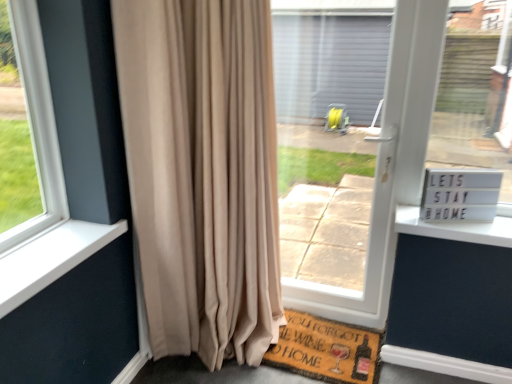
Question: Is brown mat at lower center to the right of brown woven mat at lower center from the viewer's perspective?

Choices:
 (A) yes
 (B) no

Answer: (A)

Question: From a real-world perspective, is brown mat at lower center located beneath brown woven mat at lower center?

Choices:
 (A) yes
 (B) no

Answer: (A)

Question: Considering the relative sizes of brown mat at lower center and brown woven mat at lower center in the image provided, is brown mat at lower center smaller than brown woven mat at lower center?

Choices:
 (A) yes
 (B) no

Answer: (B)

Question: From the image's perspective, does brown mat at lower center appear lower than brown woven mat at lower center?

Choices:
 (A) yes
 (B) no

Answer: (A)

Question: Is brown mat at lower center positioned behind brown woven mat at lower center?

Choices:
 (A) no
 (B) yes

Answer: (A)

Question: In the image, is transparent plastic screen door at center positioned in front of or behind brown woven mat at lower center?

Choices:
 (A) front
 (B) behind

Answer: (A)

Question: Considering the positions of transparent plastic screen door at center and brown woven mat at lower center in the image, is transparent plastic screen door at center taller or shorter than brown woven mat at lower center?

Choices:
 (A) short
 (B) tall

Answer: (B)

Question: From the image's perspective, is transparent plastic screen door at center located above or below brown woven mat at lower center?

Choices:
 (A) below
 (B) above

Answer: (B)

Question: From a real-world perspective, is transparent plastic screen door at center above or below brown woven mat at lower center?

Choices:
 (A) above
 (B) below

Answer: (A)

Question: Looking at their shapes, would you say white plastic sign at right is wider or thinner than brown mat at lower center?

Choices:
 (A) wide
 (B) thin

Answer: (B)

Question: Does point (468, 198) appear closer or farther from the camera than point (399, 374)?

Choices:
 (A) closer
 (B) farther

Answer: (A)

Question: Choose the correct answer: Is white plastic sign at right inside brown mat at lower center or outside it?

Choices:
 (A) outside
 (B) inside

Answer: (A)

Question: From the image's perspective, relative to brown mat at lower center, is white plastic sign at right above or below?

Choices:
 (A) above
 (B) below

Answer: (A)

Question: From a real-world perspective, relative to brown woven mat at lower center, is beige velvet curtain at left vertically above or below?

Choices:
 (A) below
 (B) above

Answer: (B)

Question: Considering their positions, is beige velvet curtain at left located in front of or behind brown woven mat at lower center?

Choices:
 (A) front
 (B) behind

Answer: (A)